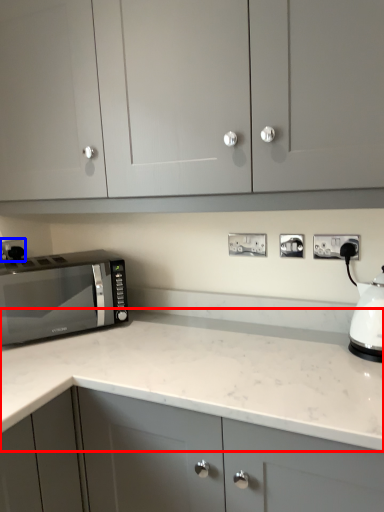
Question: Which of the following is the farthest to the observer, countertop (highlighted by a red box) or electric outlet (highlighted by a blue box)?

Choices:
 (A) countertop
 (B) electric outlet

Answer: (B)